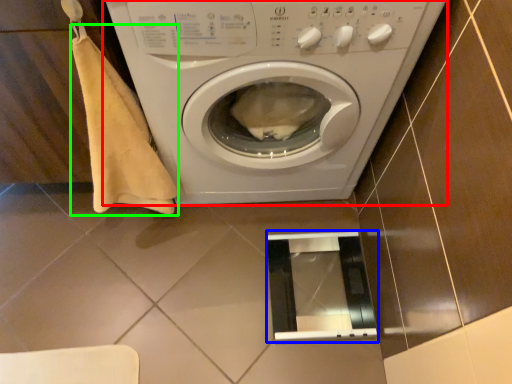
Question: Based on their relative distances, which object is nearer to washing machine (highlighted by a red box)? Choose from screen door (highlighted by a blue box) and blanket (highlighted by a green box).

Choices:
 (A) screen door
 (B) blanket

Answer: (B)